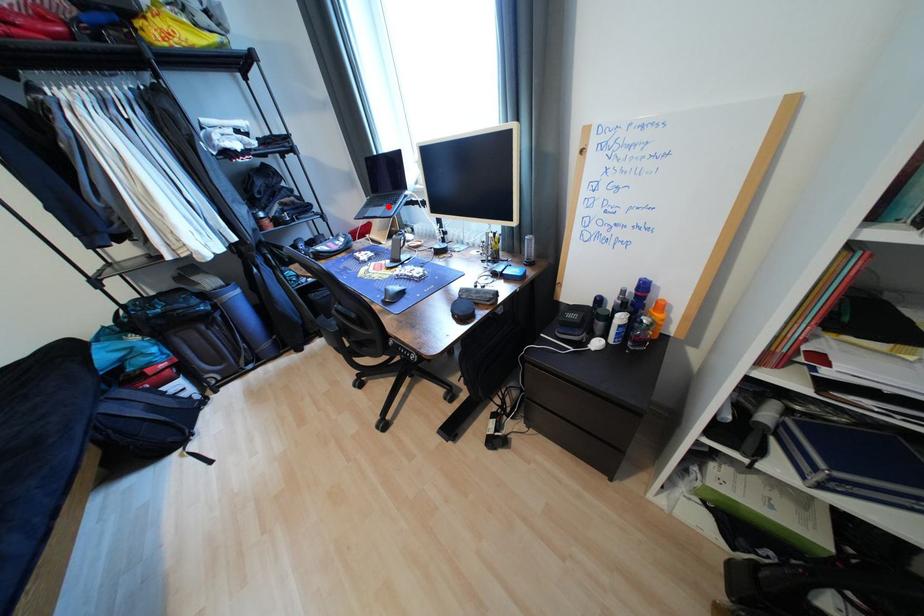
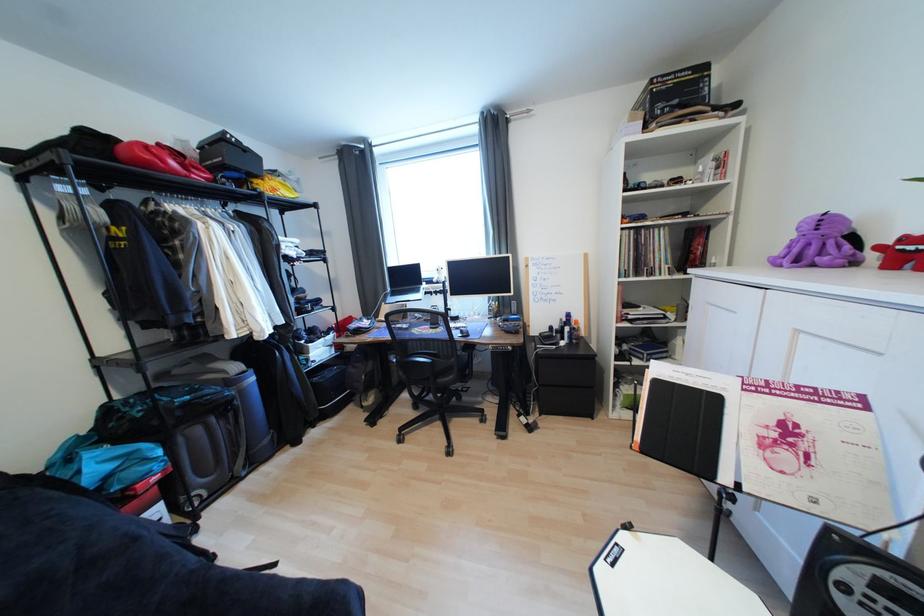
Locate, in the second image, the point that corresponds to the highlighted location in the first image.

(415, 294)